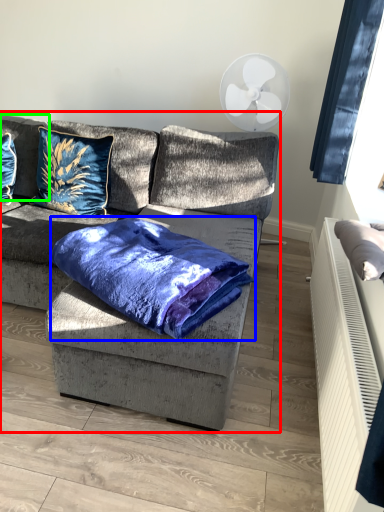
Question: Which object is positioned closest to studio couch (highlighted by a red box)? Select from cloth (highlighted by a blue box) and pillow (highlighted by a green box).

Choices:
 (A) cloth
 (B) pillow

Answer: (A)